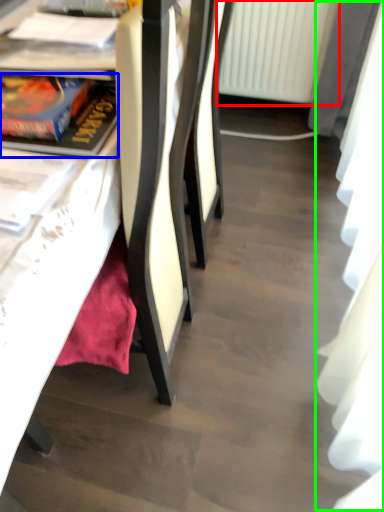
Question: Based on their relative distances, which object is nearer to radiator (highlighted by a red box)? Choose from book (highlighted by a blue box) and curtain (highlighted by a green box).

Choices:
 (A) book
 (B) curtain

Answer: (B)